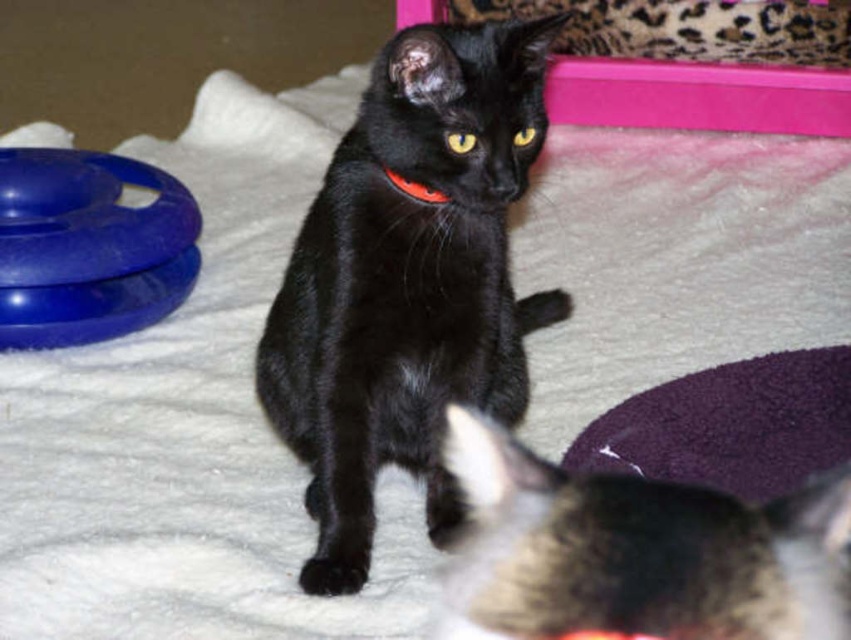
Is black glossy fur cat at center smaller than blue rubber ring at left?

No, black glossy fur cat at center is not smaller than blue rubber ring at left.

Is black glossy fur cat at center to the left of blue rubber ring at left from the viewer's perspective?

Incorrect, black glossy fur cat at center is not on the left side of blue rubber ring at left.

Where is `black glossy fur cat at center`? This screenshot has width=851, height=640. black glossy fur cat at center is located at coordinates (408, 282).

Where is `black glossy fur cat at center`? This screenshot has width=851, height=640. black glossy fur cat at center is located at coordinates (408, 282).

Measure the distance between fluffy black cat at center and camera.

fluffy black cat at center is 18.79 inches from camera.

Looking at this image, can you confirm if fluffy black cat at center is positioned below blue rubber ring at left?

Indeed, fluffy black cat at center is positioned under blue rubber ring at left.

Is point (592, 480) closer to viewer compared to point (67, 340)?

Yes, it is.

The height and width of the screenshot is (640, 851). I want to click on fluffy black cat at center, so click(x=637, y=552).

Who is taller, black glossy fur cat at center or fluffy black cat at center?

black glossy fur cat at center

In order to click on black glossy fur cat at center in this screenshot , I will do `click(408, 282)`.